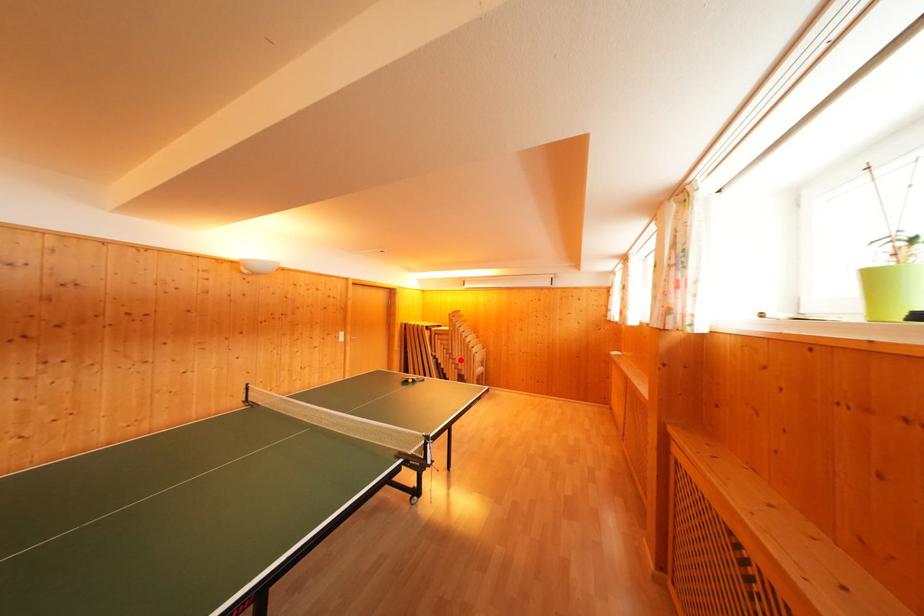
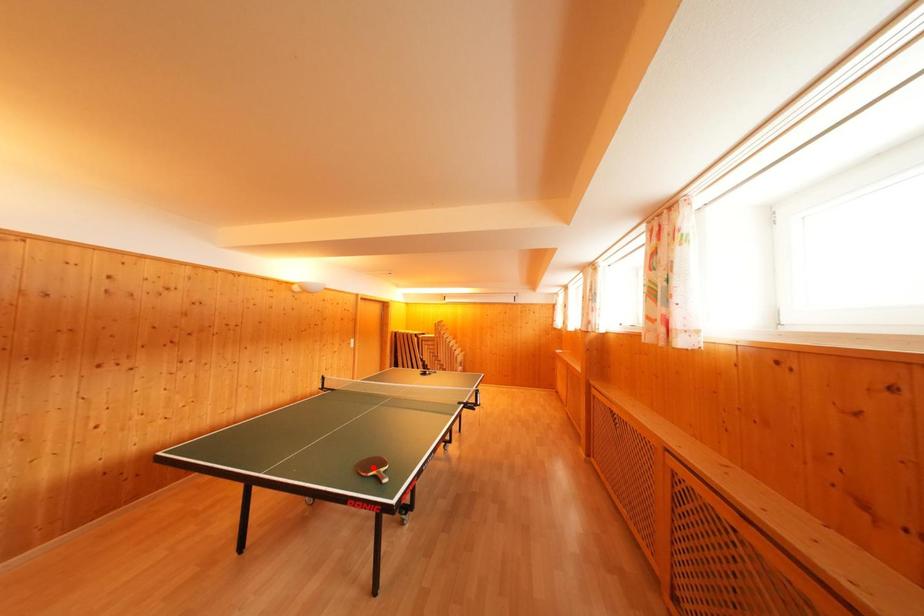
I am providing you with two images of the same scene from different viewpoints. A red point is marked on the first image and another point is marked on the second image. Is the marked point in image1 the same physical position as the marked point in image2?

No